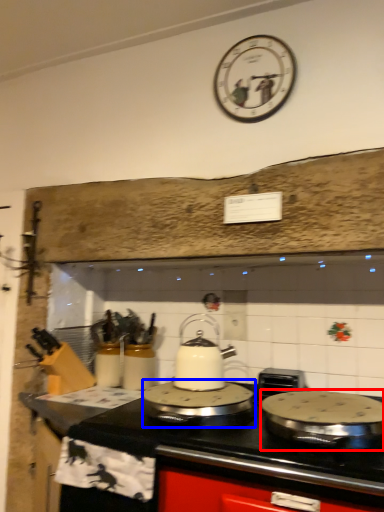
Question: Which of the following is the closest to the observer, kitchen appliance (highlighted by a red box) or kitchen appliance (highlighted by a blue box)?

Choices:
 (A) kitchen appliance
 (B) kitchen appliance

Answer: (A)